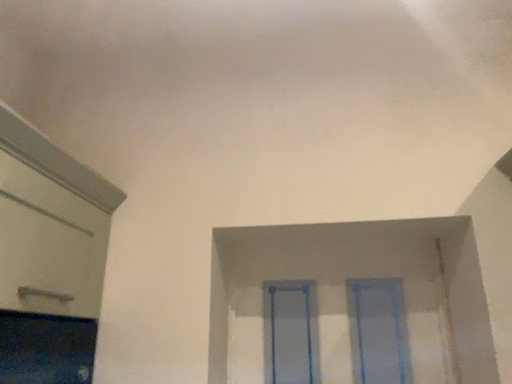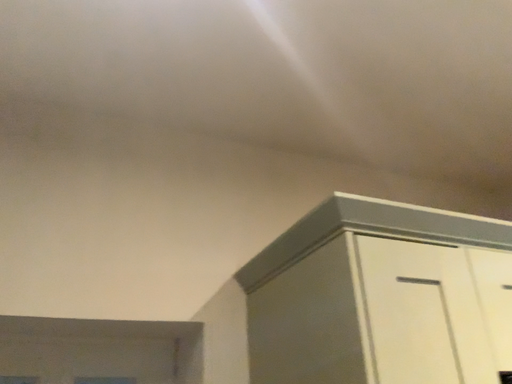
Question: How did the camera likely rotate when shooting the video?

Choices:
 (A) rotated left
 (B) rotated right

Answer: (B)